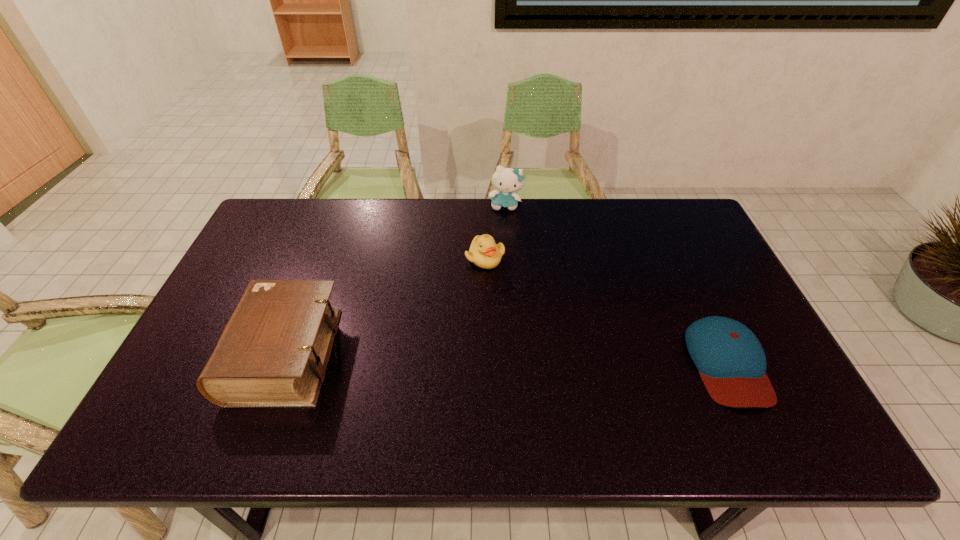
You are a GUI agent. You are given a task and a screenshot of the screen. Output one action in this format:
    pyautogui.click(x=<x>, y=<y>)
    Task: Click on the vacant spot on the desktop that is between the Bible and the baseball cap and is positioned on the beak of the duckling
    The image size is (960, 540).
    Given the screenshot: What is the action you would take?
    pyautogui.click(x=460, y=358)

Where is `free spot on the desktop that is between the third shortest object and the rightmost object and is positioned on the face of the farthest object`? Image resolution: width=960 pixels, height=540 pixels. free spot on the desktop that is between the third shortest object and the rightmost object and is positioned on the face of the farthest object is located at coordinates (489, 359).